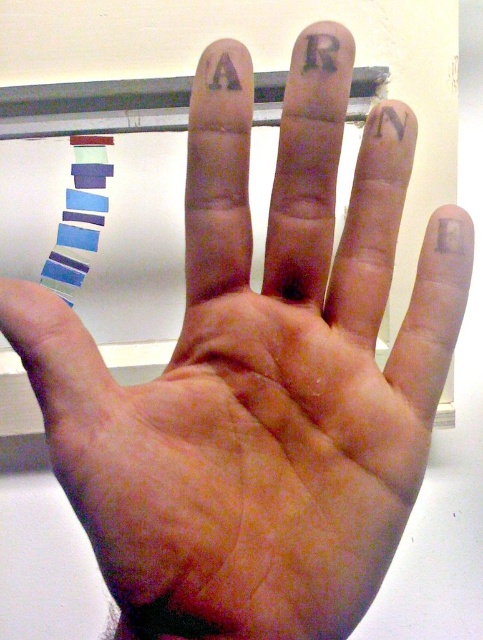
Question: Is black matte letter at upper right above matte purple letter a at upper center?

Choices:
 (A) no
 (B) yes

Answer: (A)

Question: Which point is closer to the camera taking this photo?

Choices:
 (A) (228, 74)
 (B) (386, 120)

Answer: (A)

Question: Is black matte letter at upper right positioned behind matte purple letter a at upper center?

Choices:
 (A) no
 (B) yes

Answer: (B)

Question: Which of the following is the farthest from the observer?

Choices:
 (A) black tattoo at upper center
 (B) matte purple letter a at upper center
 (C) black matte letter at upper right

Answer: (C)

Question: Based on their relative distances, which object is farther from the black tattoo at upper center?

Choices:
 (A) black matte letter at upper right
 (B) matte purple letter a at upper center

Answer: (A)

Question: Is black tattoo at upper center smaller than matte purple letter a at upper center?

Choices:
 (A) yes
 (B) no

Answer: (A)